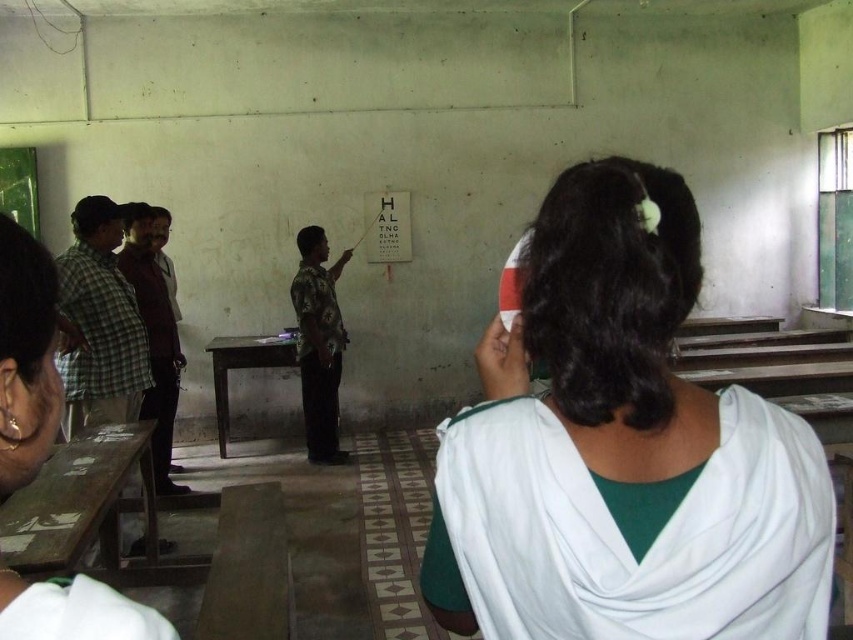
Does green plaid shirt at left have a lesser width compared to camouflage shirt at center?

Incorrect, green plaid shirt at left's width is not less than camouflage shirt at center's.

Measure the distance between green plaid shirt at left and camouflage shirt at center.

A distance of 1.68 meters exists between green plaid shirt at left and camouflage shirt at center.

The width and height of the screenshot is (853, 640). What do you see at coordinates (99, 323) in the screenshot?
I see `green plaid shirt at left` at bounding box center [99, 323].

Identify the location of green plaid shirt at left. (99, 323).

Is white fabric headband at upper center above camouflage shirt at center?

Yes.

Based on the photo, does white fabric headband at upper center appear on the left side of camouflage shirt at center?

No, white fabric headband at upper center is not to the left of camouflage shirt at center.

Is point (555, 520) in front of point (315, 442)?

Yes.

In order to click on white fabric headband at upper center in this screenshot , I will do `click(622, 451)`.

From the picture: Does white fabric headband at upper center have a greater width compared to green plaid shirt at left?

Correct, the width of white fabric headband at upper center exceeds that of green plaid shirt at left.

In the scene shown: Which is below, white fabric headband at upper center or green plaid shirt at left?

white fabric headband at upper center is below.

This screenshot has height=640, width=853. I want to click on white fabric headband at upper center, so click(x=622, y=451).